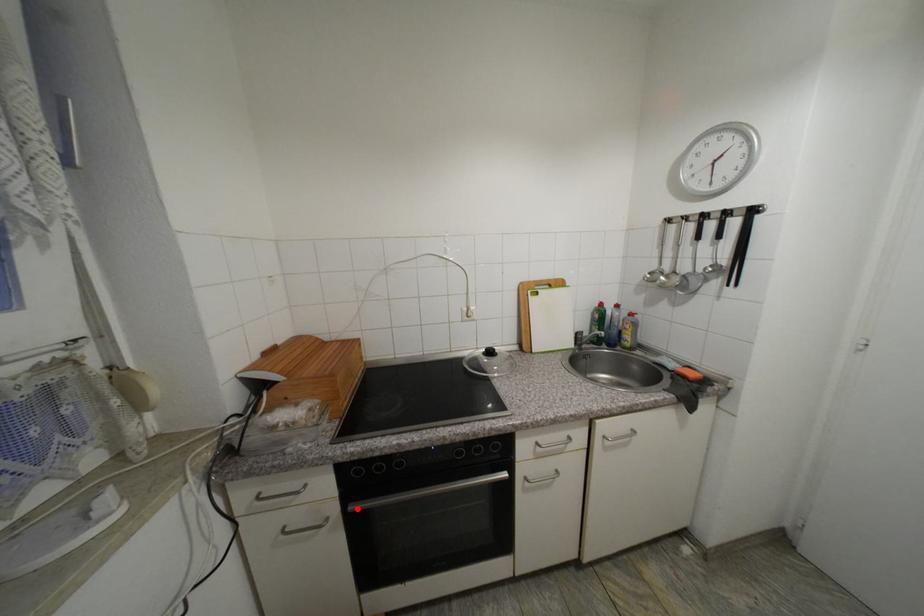
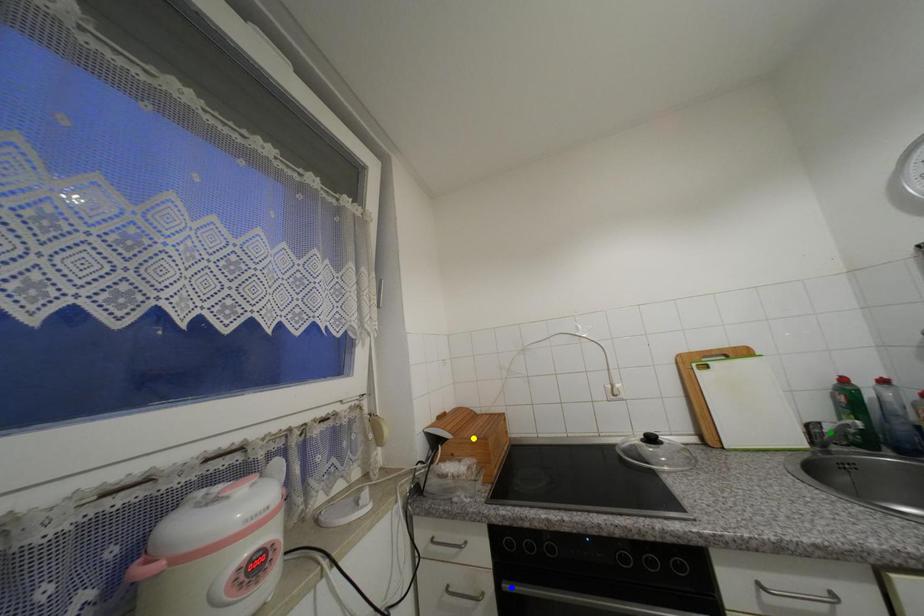
Question: I am providing you with two images of the same scene from different viewpoints. A red point is marked on the first image. You are given multiple points on the second image. Which point in image 2 represents the same 3d spot as the red point in image 1?

Choices:
 (A) green point
 (B) blue point
 (C) yellow point

Answer: (B)